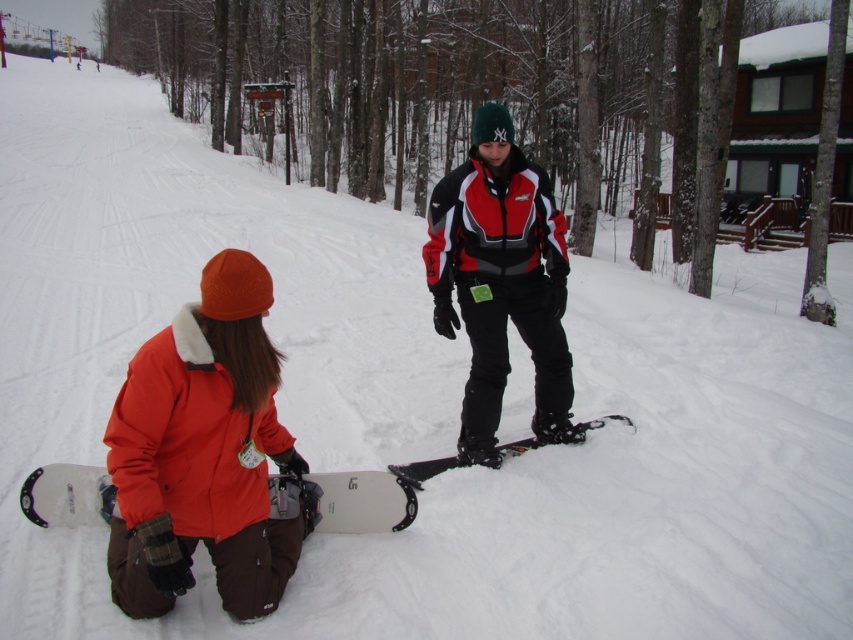
Is point (56, 464) more distant than point (393, 465)?

No.

In the scene shown: Can you confirm if white matte snowboard at lower left is shorter than black matte snowboard at center?

In fact, white matte snowboard at lower left may be taller than black matte snowboard at center.

Between point (347, 500) and point (422, 468), which one is positioned in front?

Point (347, 500) is more forward.

Locate an element on the screen. Image resolution: width=853 pixels, height=640 pixels. white matte snowboard at lower left is located at coordinates (363, 500).

Who is more distant from viewer, [183,458] or [527,440]?

The point [527,440] is more distant.

Which is more to the right, orange fleece jacket at lower left or black matte snowboard at center?

From the viewer's perspective, black matte snowboard at center appears more on the right side.

At what (x,y) coordinates should I click in order to perform the action: click on orange fleece jacket at lower left. Please return your answer as a coordinate pair (x, y). Looking at the image, I should click on (202, 452).

Is red-and-black snowsuit at center closer to the viewer compared to black matte snowboard at center?

Yes, red-and-black snowsuit at center is closer to the viewer.

Does red-and-black snowsuit at center have a greater width compared to black matte snowboard at center?

Indeed, red-and-black snowsuit at center has a greater width compared to black matte snowboard at center.

Is point (558, 212) farther from viewer compared to point (453, 458)?

No, it is not.

Find the location of `red-and-black snowsuit at center`. red-and-black snowsuit at center is located at coordinates (502, 282).